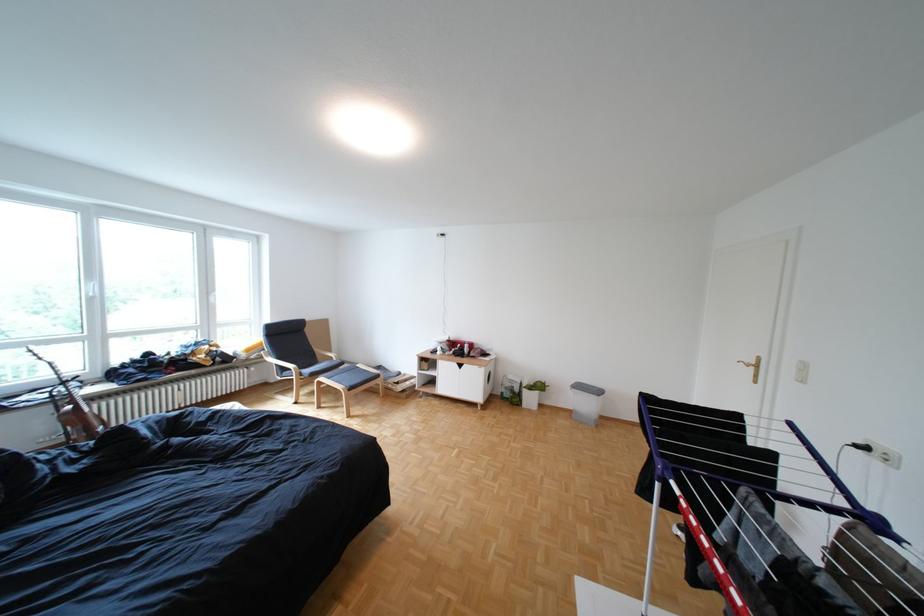
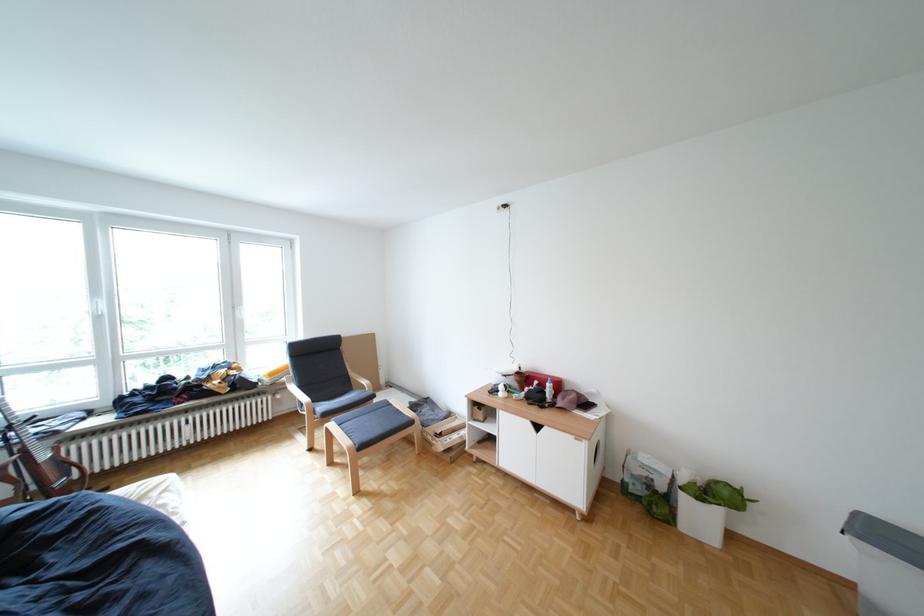
In the second image, find the point that corresponds to pixel 106 299 in the first image.

(114, 318)